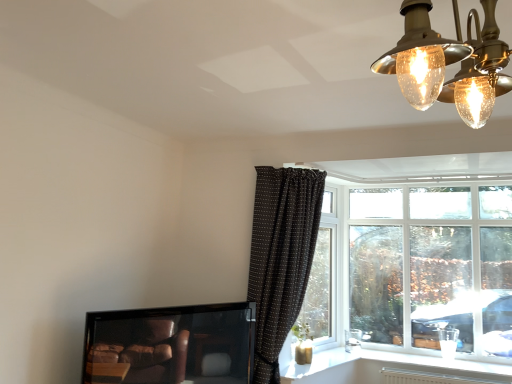
Question: Is matte black tv at lower left smaller than white plastic window sill at lower right?

Choices:
 (A) yes
 (B) no

Answer: (B)

Question: From the image's perspective, does matte black tv at lower left appear higher than white plastic window sill at lower right?

Choices:
 (A) no
 (B) yes

Answer: (B)

Question: Is matte black tv at lower left aimed at white plastic window sill at lower right?

Choices:
 (A) no
 (B) yes

Answer: (A)

Question: Is matte black tv at lower left looking in the opposite direction of white plastic window sill at lower right?

Choices:
 (A) no
 (B) yes

Answer: (A)

Question: Considering the relative sizes of matte black tv at lower left and white plastic window sill at lower right in the image provided, is matte black tv at lower left taller than white plastic window sill at lower right?

Choices:
 (A) no
 (B) yes

Answer: (B)

Question: From a real-world perspective, is matte black tv at lower left over white plastic window sill at lower right?

Choices:
 (A) no
 (B) yes

Answer: (B)

Question: From a real-world perspective, is white plastic window at upper right beneath matte black tv at lower left?

Choices:
 (A) yes
 (B) no

Answer: (B)

Question: Does white plastic window at upper right appear on the right side of matte black tv at lower left?

Choices:
 (A) no
 (B) yes

Answer: (B)

Question: Is white plastic window at upper right completely or partially outside of matte black tv at lower left?

Choices:
 (A) yes
 (B) no

Answer: (A)

Question: Could you tell me if white plastic window at upper right is turned towards matte black tv at lower left?

Choices:
 (A) no
 (B) yes

Answer: (B)

Question: From the image's perspective, is white plastic window at upper right beneath matte black tv at lower left?

Choices:
 (A) yes
 (B) no

Answer: (B)

Question: Can you confirm if white plastic window at upper right is taller than matte black tv at lower left?

Choices:
 (A) no
 (B) yes

Answer: (B)

Question: From a real-world perspective, is gold textured chandelier at upper right positioned over white plastic window sill at lower right based on gravity?

Choices:
 (A) no
 (B) yes

Answer: (B)